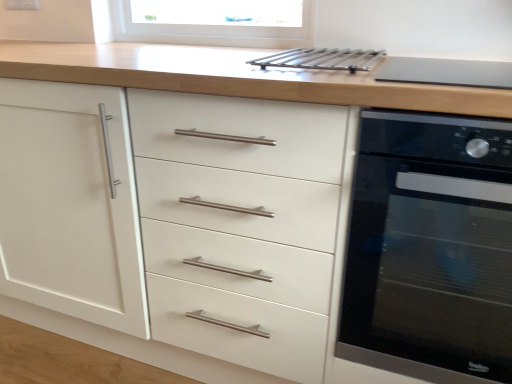
Question: Considering the positions of metallic silver rack at upper center and black glass oven at right in the image, is metallic silver rack at upper center taller or shorter than black glass oven at right?

Choices:
 (A) short
 (B) tall

Answer: (A)

Question: Do you think metallic silver rack at upper center is within black glass oven at right, or outside of it?

Choices:
 (A) outside
 (B) inside

Answer: (A)

Question: Which object is the farthest from the matte black cooktop at upper right?

Choices:
 (A) metallic silver rack at upper center
 (B) black glass oven at right

Answer: (B)

Question: Which object is positioned closest to the metallic silver rack at upper center?

Choices:
 (A) black glass oven at right
 (B) matte black cooktop at upper right

Answer: (B)